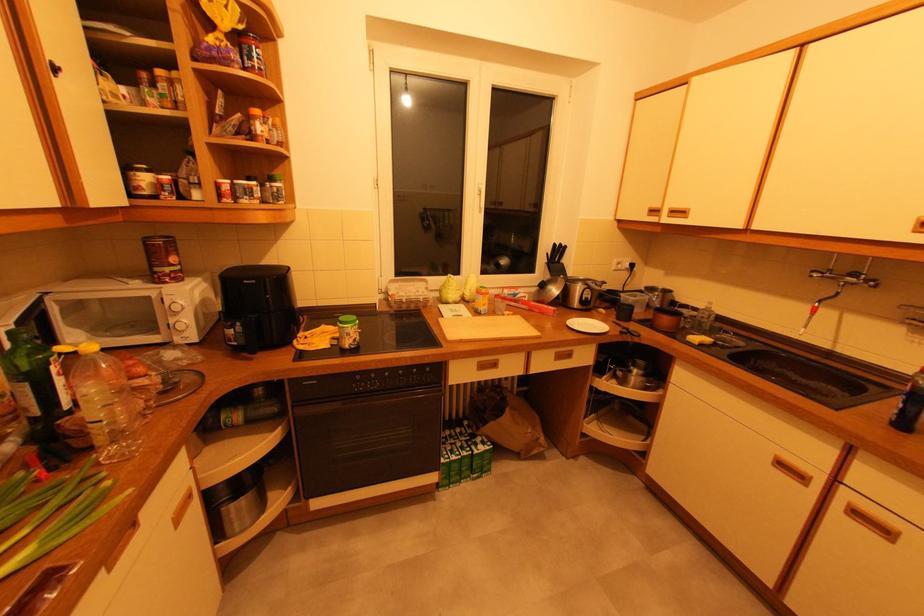
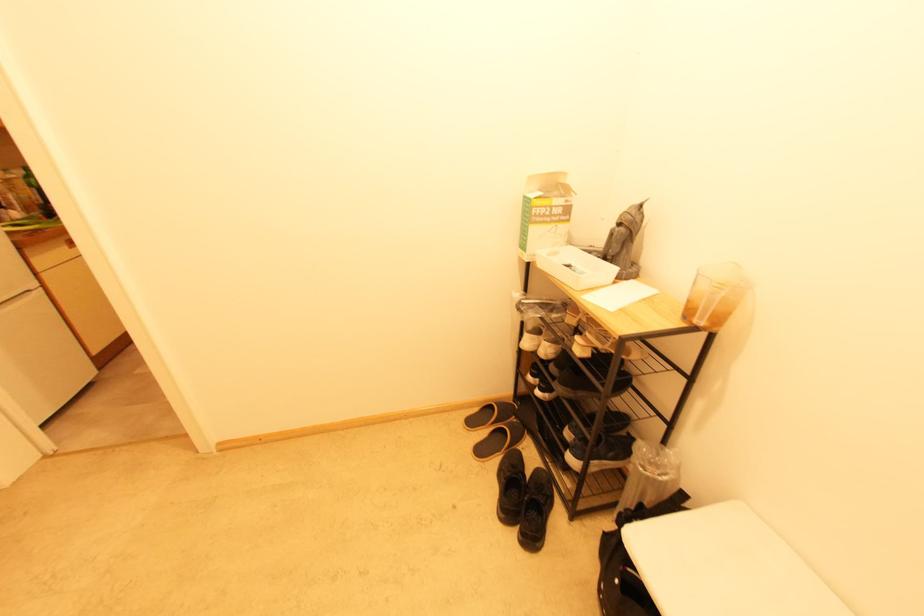
What movement of the cameraman would produce the second image?

The movement direction of the cameraman is right, backward.